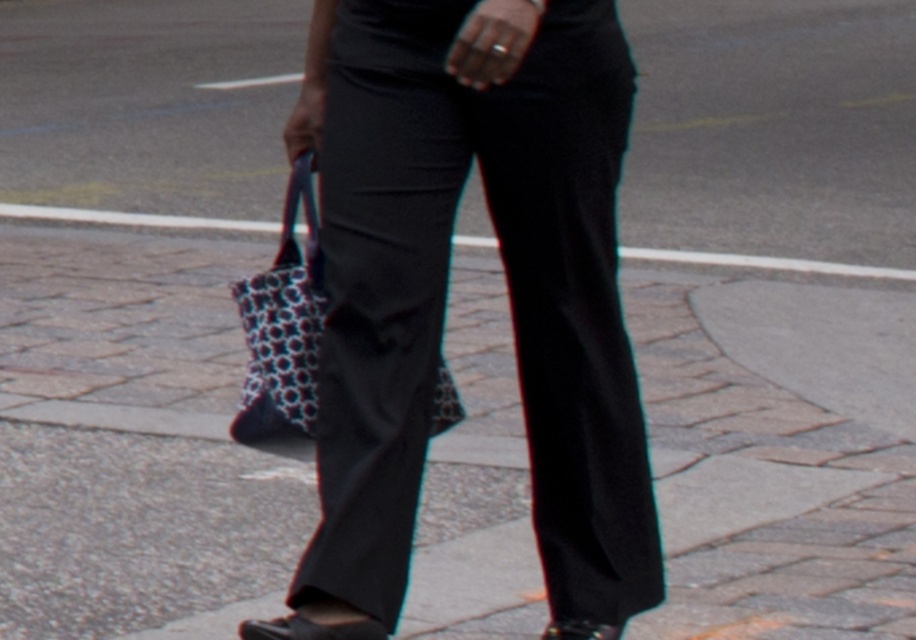
Can you confirm if black smooth pants at center is positioned below black leather sandal at lower center?

Actually, black smooth pants at center is above black leather sandal at lower center.

Which is in front, point (565, 1) or point (376, 632)?

Point (376, 632) is in front.

This screenshot has height=640, width=916. I want to click on black smooth pants at center, so click(446, 288).

Does point (319, 628) come behind point (601, 636)?

That is False.

Does point (302, 621) come closer to viewer compared to point (598, 637)?

Yes, point (302, 621) is in front of point (598, 637).

Who is more forward, (324, 634) or (565, 632)?

Point (324, 634) is more forward.

Where is `black leather sandal at lower center`? Image resolution: width=916 pixels, height=640 pixels. black leather sandal at lower center is located at coordinates [311, 628].

Is black smooth pants at center smaller than patterned fabric bag at center?

No, black smooth pants at center is not smaller than patterned fabric bag at center.

Can you confirm if black smooth pants at center is positioned to the left of patterned fabric bag at center?

No, black smooth pants at center is not to the left of patterned fabric bag at center.

Where is `black smooth pants at center`? This screenshot has height=640, width=916. black smooth pants at center is located at coordinates (446, 288).